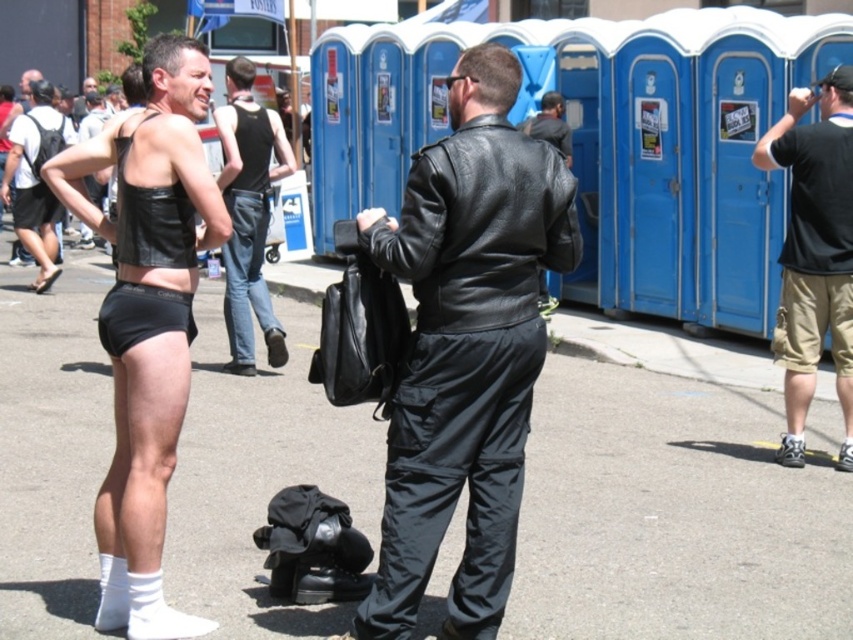
Between black leather jacket at center and leather tank top at center, which one has more height?

With more height is leather tank top at center.

Does point (490, 144) come in front of point (231, 353)?

Yes, it is.

At what (x,y) coordinates should I click in order to perform the action: click on black leather jacket at center. Please return your answer as a coordinate pair (x, y). Looking at the image, I should click on (466, 346).

The width and height of the screenshot is (853, 640). I want to click on black leather jacket at center, so click(466, 346).

Is black leather jacket at center further to the viewer compared to black matte underwear at center?

No, it is in front of black matte underwear at center.

Can you confirm if black leather jacket at center is smaller than black matte underwear at center?

Incorrect, black leather jacket at center is not smaller in size than black matte underwear at center.

Is point (402, 556) less distant than point (108, 337)?

Yes, point (402, 556) is in front of point (108, 337).

Where is `black leather jacket at center`? black leather jacket at center is located at coordinates (466, 346).

Is leather-like black bikini top at left shorter than black matte underwear at center?

Incorrect, leather-like black bikini top at left's height does not fall short of black matte underwear at center's.

Which is below, leather-like black bikini top at left or black matte underwear at center?

Positioned lower is leather-like black bikini top at left.

Locate an element on the screen. Image resolution: width=853 pixels, height=640 pixels. leather-like black bikini top at left is located at coordinates (148, 320).